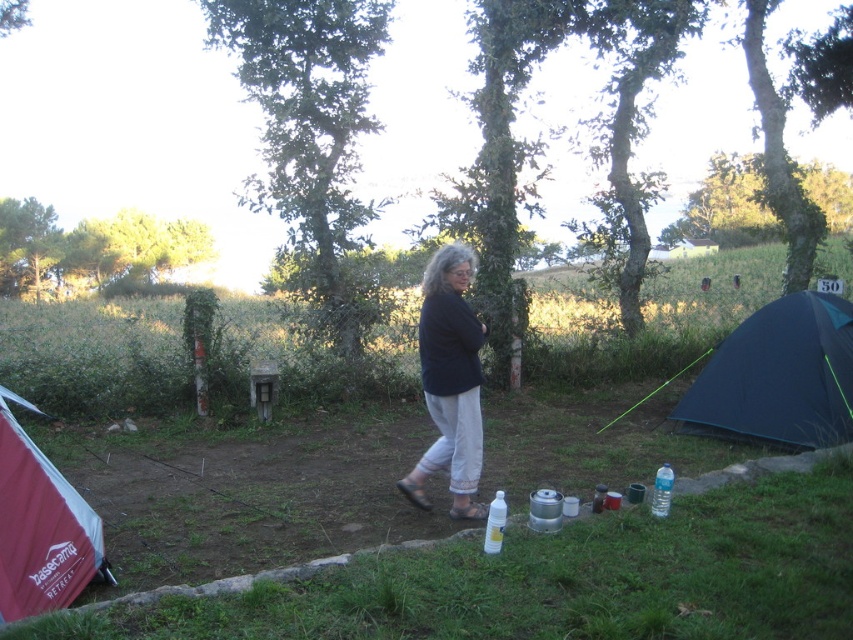
Question: Among these objects, which one is nearest to the camera?

Choices:
 (A) black cotton shirt at center
 (B) red fabric tent at lower left
 (C) clear plastic bottle at lower center

Answer: (B)

Question: Is red fabric tent at lower left bigger than clear plastic bottle at lower center?

Choices:
 (A) no
 (B) yes

Answer: (B)

Question: Is dark blue fabric tent at right to the left of white plastic bottle at center from the viewer's perspective?

Choices:
 (A) no
 (B) yes

Answer: (A)

Question: Which of these objects is positioned farthest from the dark blue fabric tent at right?

Choices:
 (A) clear plastic bottle at lower center
 (B) white plastic bottle at center

Answer: (B)

Question: Which object appears closest to the camera in this image?

Choices:
 (A) transparent plastic bottle at lower center
 (B) red fabric tent at lower left
 (C) black cotton shirt at center
 (D) white plastic bottle at center

Answer: (B)

Question: Observing the image, what is the correct spatial positioning of red fabric tent at lower left in reference to clear plastic bottle at lower center?

Choices:
 (A) left
 (B) right

Answer: (A)